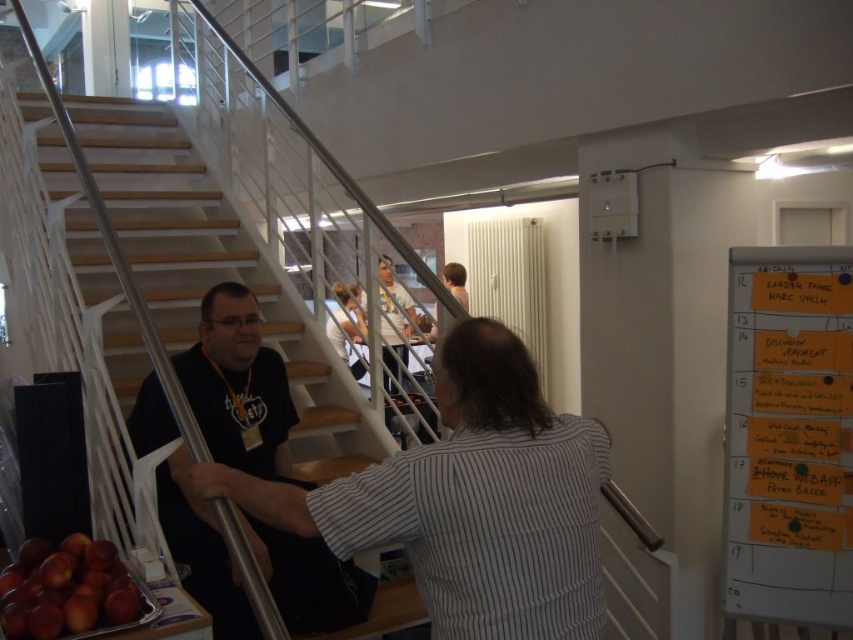
You are standing at the bottom of the wooden stairs at lower left and want to greet the person wearing the matte black shirt at left. Which direction should you move to reach them?

The wooden stairs at lower left is positioned over matte black shirt at left, so you should move downward or backward away from the stairs to reach the matte black shirt at left.

You are standing at the entrance of the office and see the wooden stairs at lower left and the matte black shirt at left. Which object is located more to the left side of the scene?

The wooden stairs at lower left is positioned on the left side of matte black shirt at left, so the wooden stairs at lower left is more to the left.